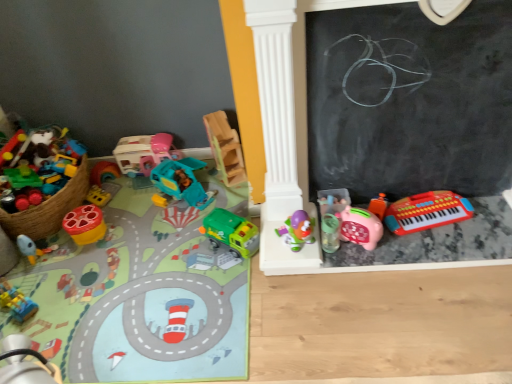
Where is `free space to the back side of shiny plastic toy at left, arranged as the 3th toy when viewed from the left`? The image size is (512, 384). free space to the back side of shiny plastic toy at left, arranged as the 3th toy when viewed from the left is located at coordinates (115, 203).